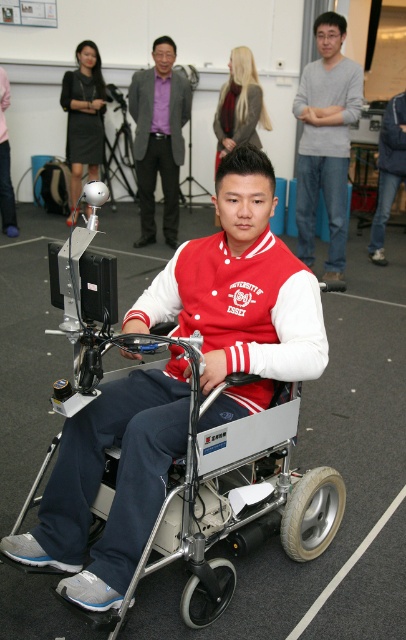
You are an event organizer planning to move the silver metallic mobility scooter at center and the matte black dress at upper left to another location. Based on their positions in the image, which object should you move first to avoid blocking the other?

The silver metallic mobility scooter at center should be moved first because it is in front of the matte black dress at upper left. Moving it first will prevent blocking access to the dress.

You are attending a conference and notice a man in a red varsity jacket seated in a motorized wheelchair with a mounted camera system. Where is the purple shirt at center in relation to the man?

The purple shirt at center is located at point coordinates (159,138) relative to the man in the red varsity jacket.